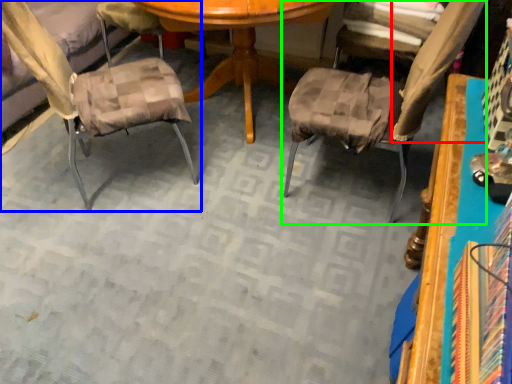
Question: Which is nearer to the fabric (highlighted by a red box)? chair (highlighted by a blue box) or chair (highlighted by a green box).

Choices:
 (A) chair
 (B) chair

Answer: (B)